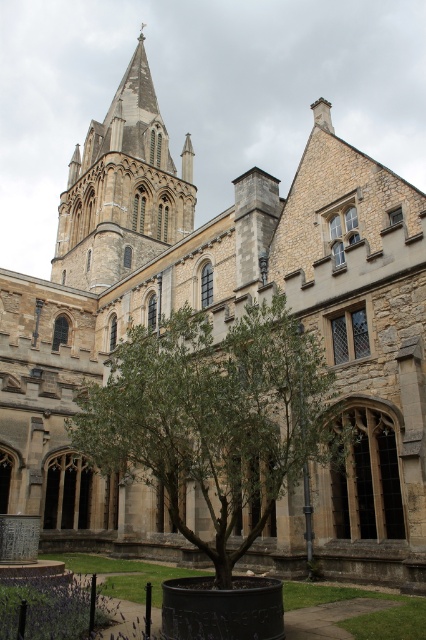
Question: Which of the following is the farthest from the observer?

Choices:
 (A) green leafy tree at center
 (B) smooth stone tower at upper left

Answer: (B)

Question: Is green leafy tree at center to the right of smooth stone tower at upper left from the viewer's perspective?

Choices:
 (A) no
 (B) yes

Answer: (B)

Question: Which point is closer to the camera?

Choices:
 (A) smooth stone tower at upper left
 (B) green leafy tree at center

Answer: (B)

Question: Which of the following is the closest to the observer?

Choices:
 (A) green leafy tree at center
 (B) smooth stone tower at upper left

Answer: (A)

Question: Is green leafy tree at center to the left of smooth stone tower at upper left from the viewer's perspective?

Choices:
 (A) yes
 (B) no

Answer: (B)

Question: Is green leafy tree at center wider than smooth stone tower at upper left?

Choices:
 (A) yes
 (B) no

Answer: (B)